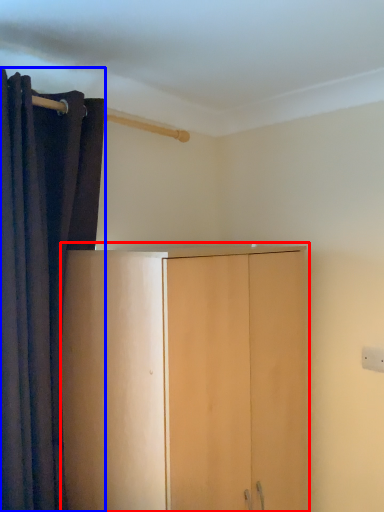
Question: Which point is further to the camera, cupboard (highlighted by a red box) or curtain (highlighted by a blue box)?

Choices:
 (A) cupboard
 (B) curtain

Answer: (B)